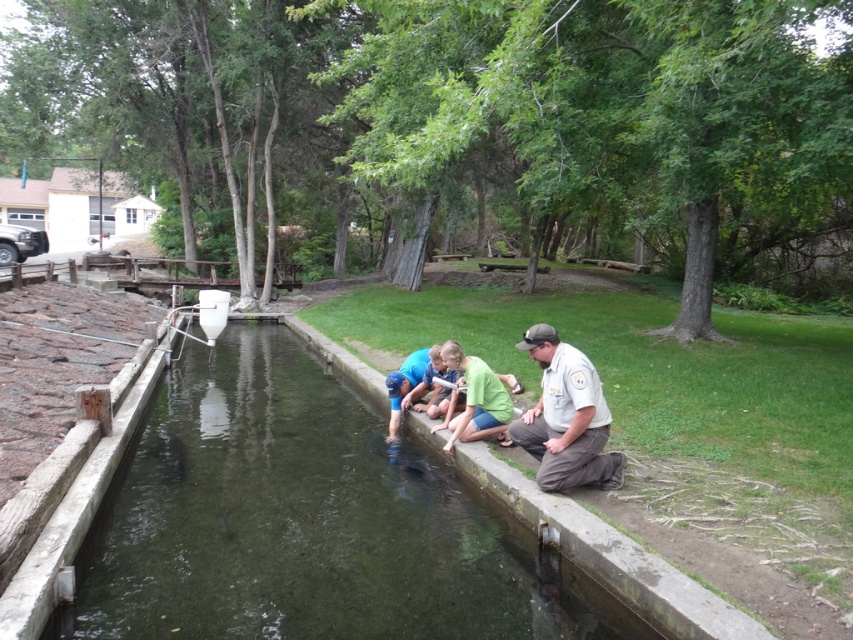
Question: Estimate the real-world distances between objects in this image. Which object is farther from the blue fabric squat at center?

Choices:
 (A) clear concrete water at center
 (B) khaki uniform at center
 (C) green cotton shirt at center

Answer: (B)

Question: Is green cotton shirt at center to the left of blue fabric squat at center from the viewer's perspective?

Choices:
 (A) yes
 (B) no

Answer: (B)

Question: Which of the following is the farthest from the observer?

Choices:
 (A) clear concrete water at center
 (B) blue fabric squat at center
 (C) khaki uniform at center

Answer: (B)

Question: Does green cotton shirt at center lie behind blue fabric squat at center?

Choices:
 (A) yes
 (B) no

Answer: (B)

Question: Among these objects, which one is nearest to the camera?

Choices:
 (A) clear concrete water at center
 (B) green cotton shirt at center
 (C) blue fabric squat at center

Answer: (A)

Question: Can you confirm if clear concrete water at center is bigger than blue fabric squat at center?

Choices:
 (A) yes
 (B) no

Answer: (A)